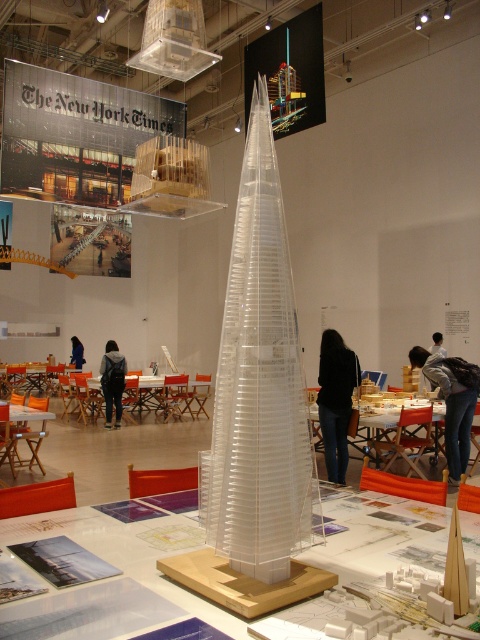
Who is higher up, dark blue jacket at center or black fabric at center?

Positioned higher is black fabric at center.

Does point (107, 356) come closer to viewer compared to point (444, 352)?

No, it is not.

Where is `dark blue jacket at center`? This screenshot has height=640, width=480. dark blue jacket at center is located at coordinates (112, 380).

Can you confirm if transparent plastic tower at center is bigger than black leather jacket at center?

Indeed, transparent plastic tower at center has a larger size compared to black leather jacket at center.

Find the location of `transparent plastic tower at center`. transparent plastic tower at center is located at coordinates tap(260, 385).

Who is more forward, (78,362) or (435,353)?

Positioned in front is point (435,353).

Can you confirm if blue fabric jacket at center is positioned above black fabric at center?

Incorrect, blue fabric jacket at center is not positioned above black fabric at center.

Between point (81, 355) and point (443, 348), which one is positioned behind?

The point (81, 355) is more distant.

I want to click on blue fabric jacket at center, so click(76, 353).